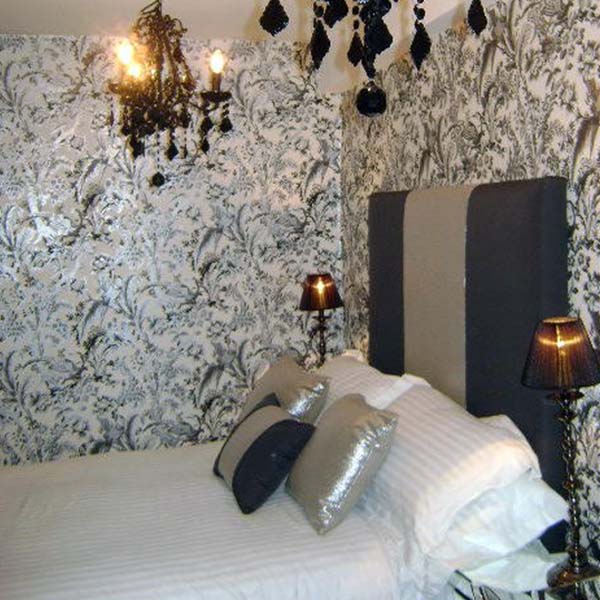
Where is `light`? This screenshot has height=600, width=600. light is located at coordinates (218, 63).